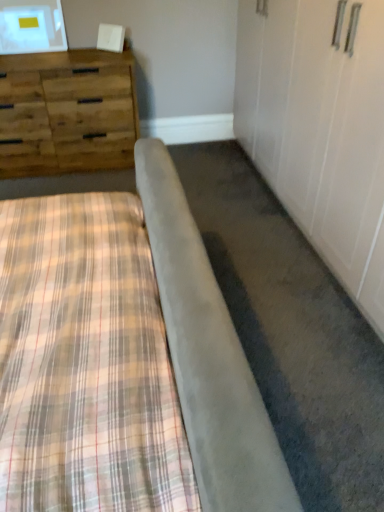
At what (x,y) coordinates should I click in order to perform the action: click on empty space that is ontop of woodenmaterial/texturechest of drawers at upper left (from a real-world perspective). Please return your answer as a coordinate pair (x, y). The height and width of the screenshot is (512, 384). Looking at the image, I should click on (59, 52).